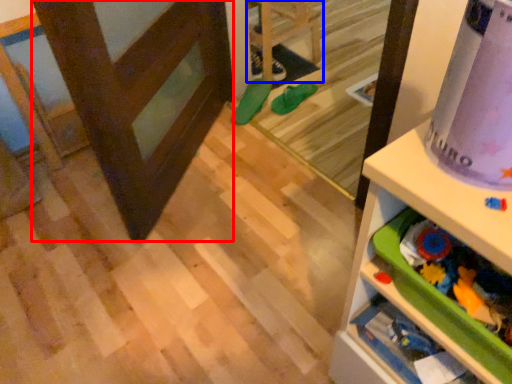
Question: Which object is further to the camera taking this photo, screen door (highlighted by a red box) or furniture (highlighted by a blue box)?

Choices:
 (A) screen door
 (B) furniture

Answer: (B)